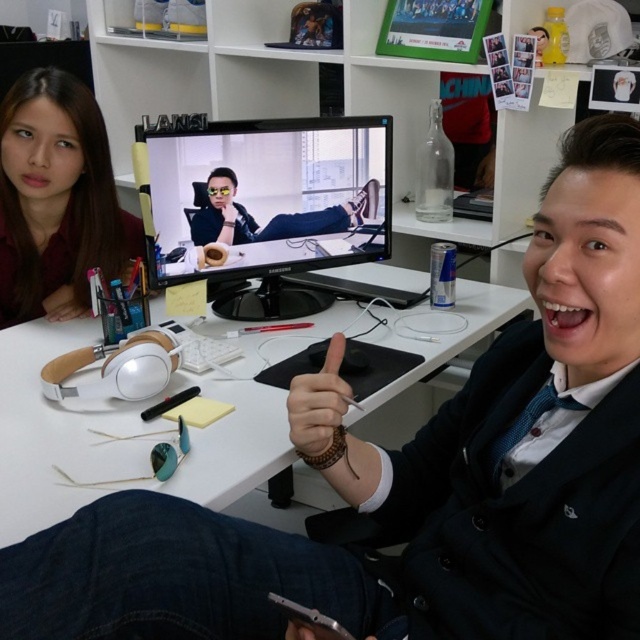
Question: Is white matte computer desk at center wider than black glossy monitor at center?

Choices:
 (A) no
 (B) yes

Answer: (B)

Question: Among these objects, which one is nearest to the camera?

Choices:
 (A) white matte computer desk at center
 (B) brown leather hand at center
 (C) black glossy monitor at center

Answer: (A)

Question: Which of the following is the farthest from the observer?

Choices:
 (A) black glossy monitor at center
 (B) brown leather hand at center

Answer: (A)

Question: Does white matte computer desk at center have a larger size compared to matte brown hair at upper left?

Choices:
 (A) yes
 (B) no

Answer: (A)

Question: Is white matte computer desk at center to the right of brown leather hand at center from the viewer's perspective?

Choices:
 (A) yes
 (B) no

Answer: (B)

Question: Which is farther from the matte brown hair at upper left?

Choices:
 (A) white matte computer desk at center
 (B) black glossy monitor at center

Answer: (B)